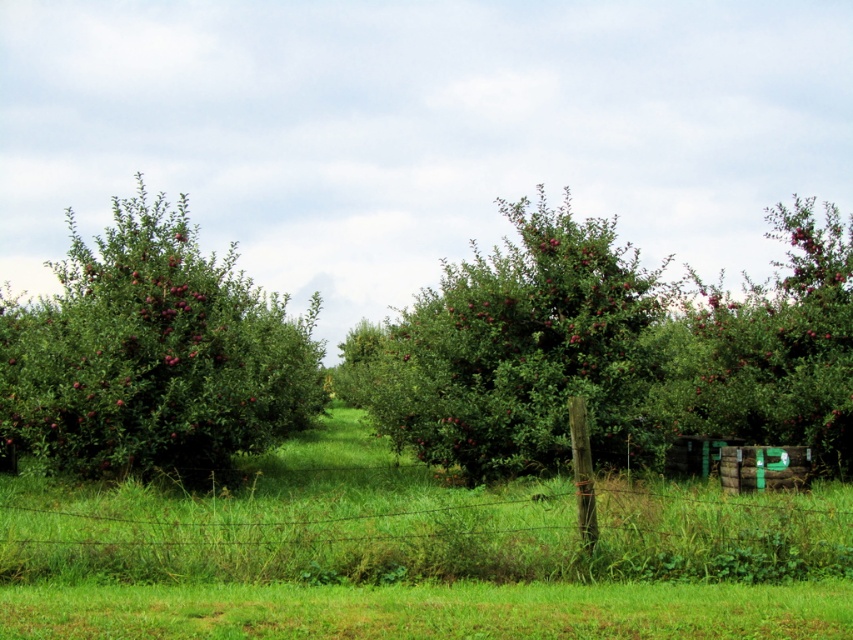
You are standing at the center of the orchard and want to pick an apple from the green leafy tree at center. Considering your position, which direction should you walk to reach the tree?

Since you are already at the center of the orchard and the green leafy tree at center is located at point (x=515, y=349), you are already near the tree and do not need to move further in any specific direction.

You are standing in the orchard and see two points marked in the image. The first point is at coordinates point [529,573] and the second is at point [717,307]. Which point is closer to you?

Point [529,573] is in front of point [717,307], so the first point is closer to you.

You are a farmer checking the orchard. You notice the green leafy tree at center and the smooth green crate at center. Which object is taller?

The green leafy tree at center is taller than the smooth green crate at center according to the description.